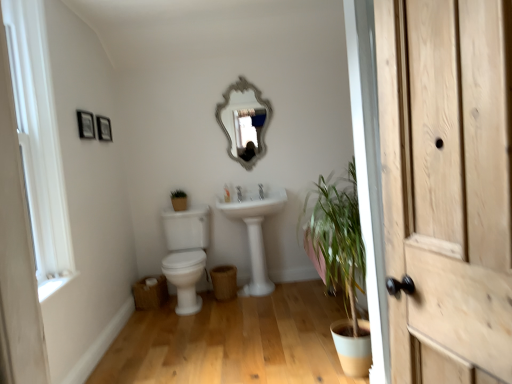
Question: Considering their positions, is white glossy toilet at center-left located in front of or behind white ceramic tap at center?

Choices:
 (A) front
 (B) behind

Answer: (A)

Question: Is white glossy toilet at center-left situated inside white ceramic tap at center or outside?

Choices:
 (A) inside
 (B) outside

Answer: (B)

Question: Estimate the real-world distances between objects in this image. Which object is closer to the silver/glass mirror at upper center?

Choices:
 (A) white ceramic tap at center
 (B) white glossy toilet at center-left
 (C) light brown wood door at right
 (D) white glossy sink at center
 (E) wooden picture frame at upper left, which is counted as the 2th picture frame, starting from the front

Answer: (A)

Question: Which of these objects is positioned farthest from the white painted wood window frame at left?

Choices:
 (A) wooden picture frame at upper left, positioned as the first picture frame in front-to-back order
 (B) white glossy toilet at center-left
 (C) white glossy sink at center
 (D) white glossy toilet at lower left
 (E) light brown wood door at right

Answer: (E)